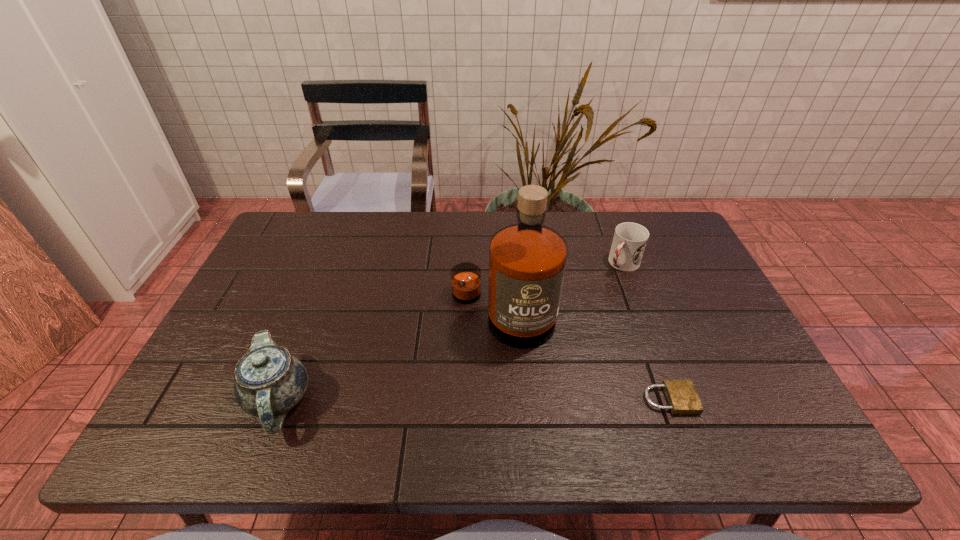
The height and width of the screenshot is (540, 960). I want to click on free space on the desktop that is between the leftmost object and the padlock and is positioned on the side of the third tallest object where the handle is located, so click(497, 400).

Locate an element on the screen. vacant space on the desktop that is between the chinaware and the padlock and is positioned on the front label of the liquor is located at coordinates (440, 400).